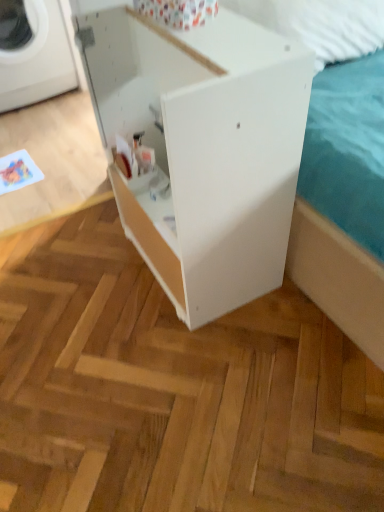
Question: Is white plastic washing machine at left in front of or behind white matte cabinet at center in the image?

Choices:
 (A) front
 (B) behind

Answer: (B)

Question: Looking at their shapes, would you say white plastic washing machine at left is wider or thinner than white matte cabinet at center?

Choices:
 (A) wide
 (B) thin

Answer: (A)

Question: Considering the positions of point (36, 39) and point (187, 96), is point (36, 39) closer or farther from the camera than point (187, 96)?

Choices:
 (A) closer
 (B) farther

Answer: (B)

Question: Is point (94, 17) positioned closer to the camera than point (38, 10)?

Choices:
 (A) farther
 (B) closer

Answer: (B)

Question: Is white matte cabinet at center inside or outside of white plastic washing machine at left?

Choices:
 (A) inside
 (B) outside

Answer: (B)

Question: Looking at the image, does white matte cabinet at center seem bigger or smaller compared to white plastic washing machine at left?

Choices:
 (A) big
 (B) small

Answer: (A)

Question: In terms of width, does white matte cabinet at center look wider or thinner when compared to white plastic washing machine at left?

Choices:
 (A) thin
 (B) wide

Answer: (A)